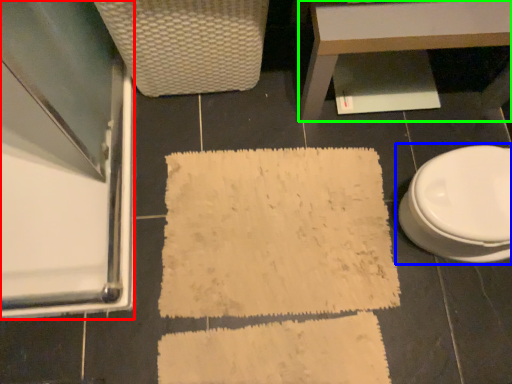
Question: Which is nearer to the screen door (highlighted by a red box)? toilet (highlighted by a blue box) or table (highlighted by a green box).

Choices:
 (A) toilet
 (B) table

Answer: (B)